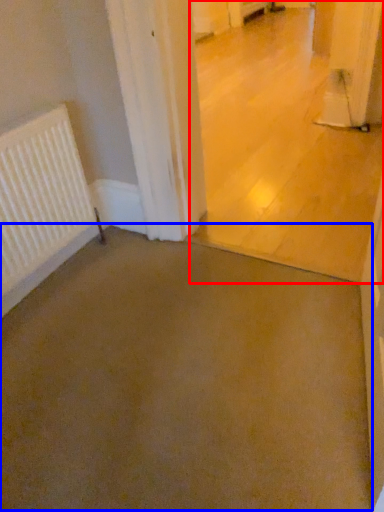
Question: Which object is further to the camera taking this photo, concrete (highlighted by a red box) or concrete (highlighted by a blue box)?

Choices:
 (A) concrete
 (B) concrete

Answer: (A)